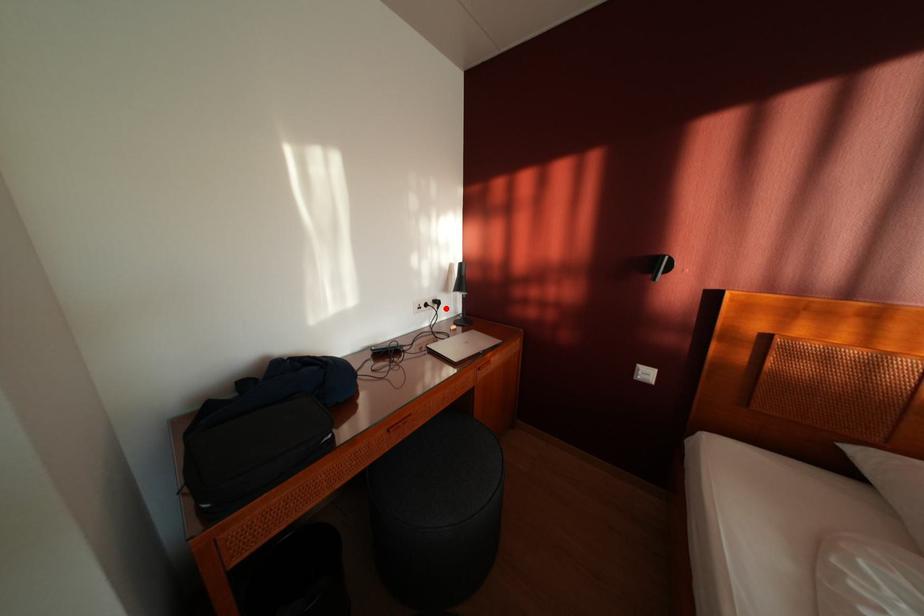
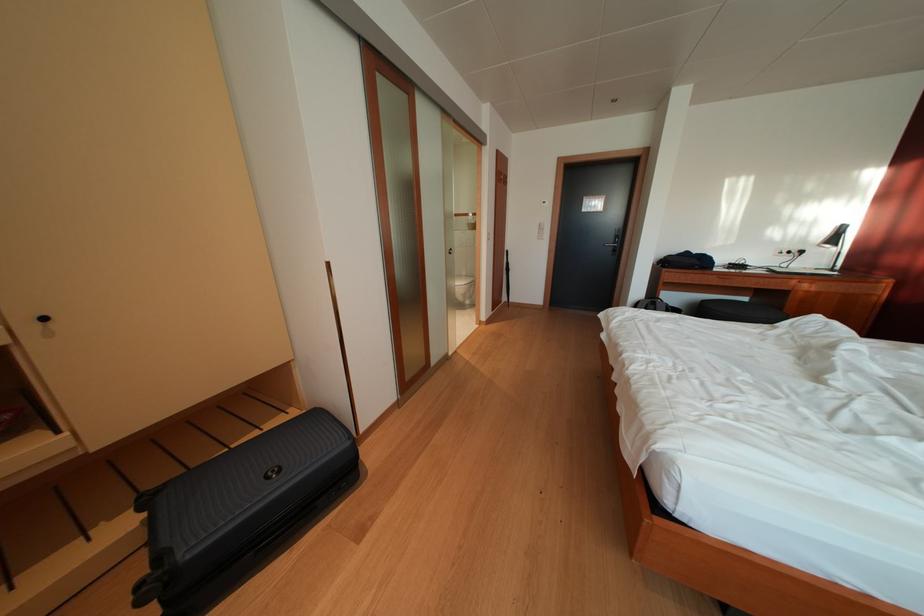
Where in the second image is the point corresponding to the highlighted location from the first image?

(809, 257)